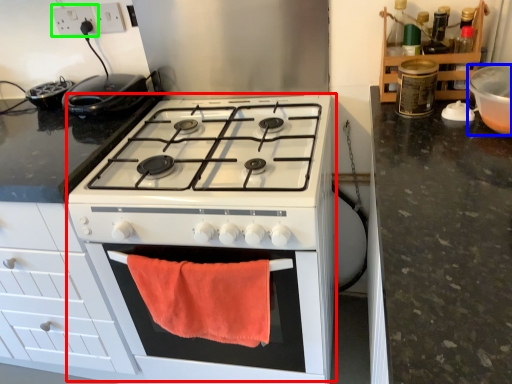
Question: Estimate the real-world distances between objects in this image. Which object is closer to appliance (highlighted by a red box), appliance (highlighted by a blue box) or electric outlet (highlighted by a green box)?

Choices:
 (A) appliance
 (B) electric outlet

Answer: (A)